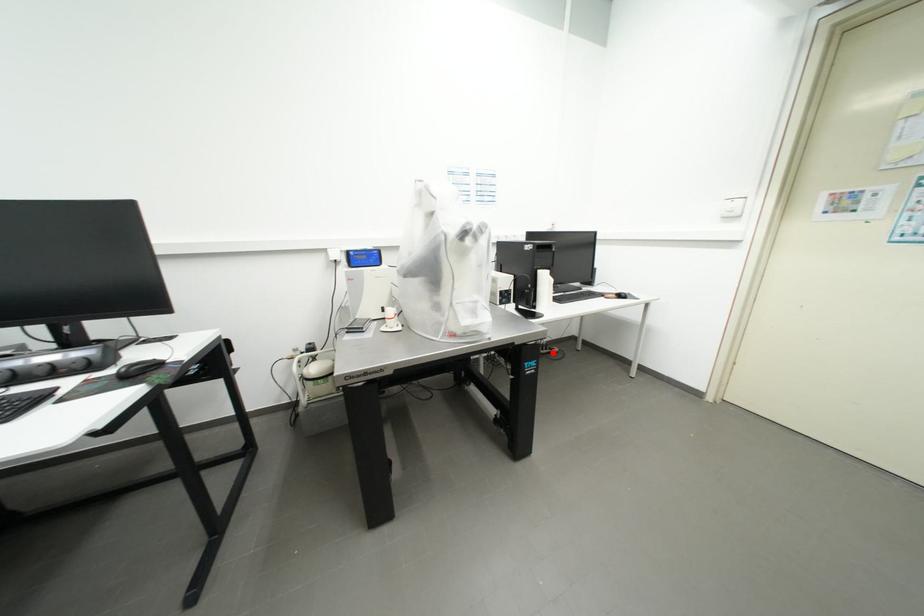
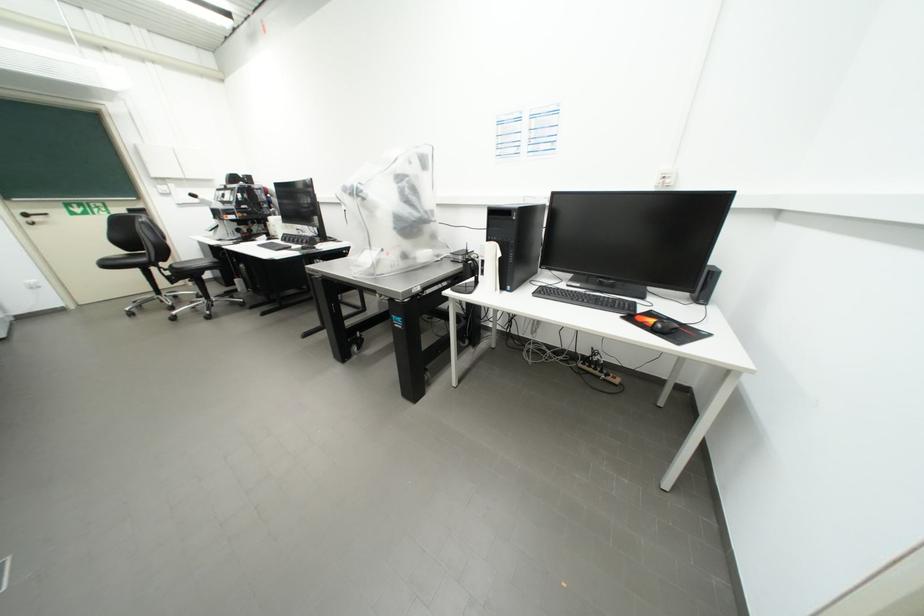
Question: I am providing you with two images of the same scene from different viewpoints. Given a red point in image1, look at the same physical point in image2. Is it:

Choices:
 (A) Closer to the viewpoint
 (B) Farther from the viewpoint

Answer: (A)